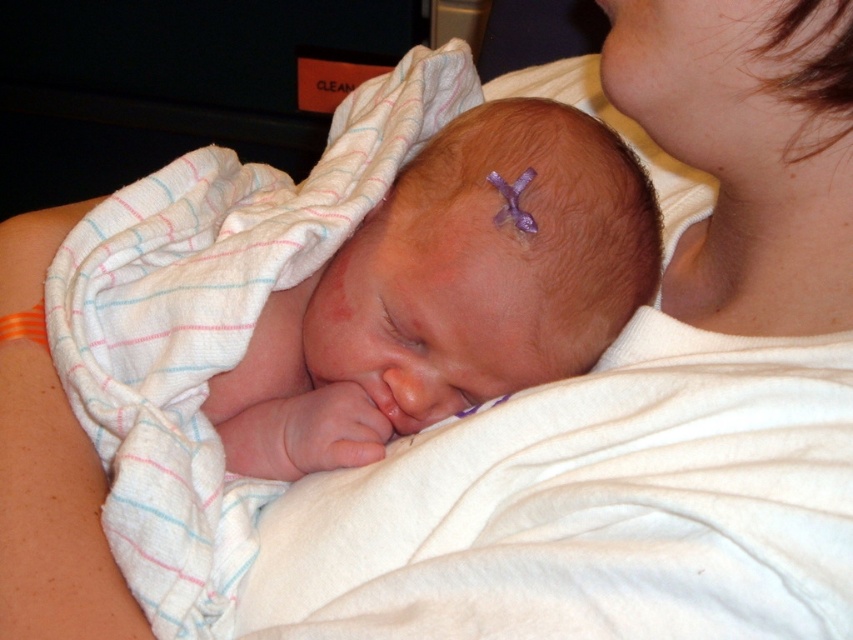
What do you see at coordinates (448, 292) in the screenshot?
I see `smooth skin newborn at center` at bounding box center [448, 292].

Is point (352, 275) farther from viewer compared to point (19, 538)?

That is True.

This screenshot has width=853, height=640. I want to click on smooth skin newborn at center, so click(448, 292).